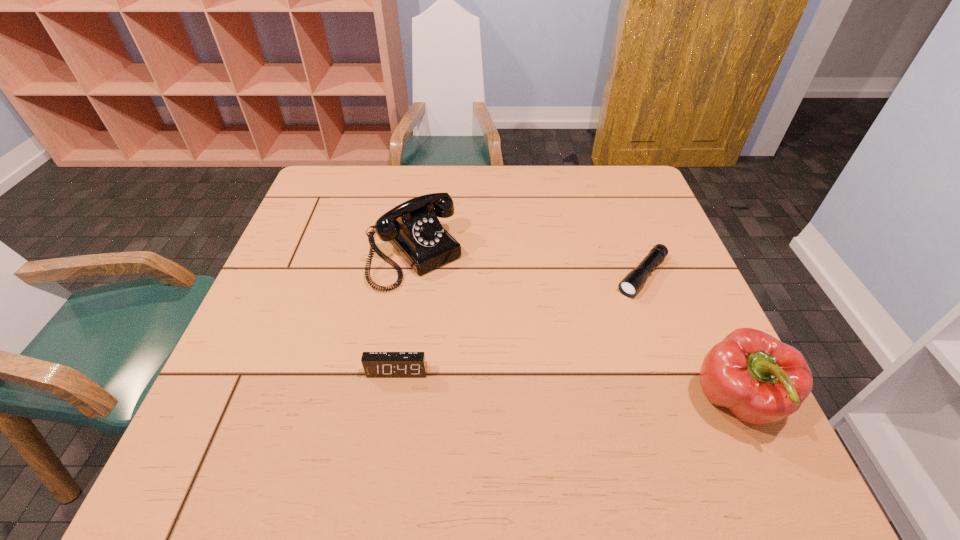
The image size is (960, 540). I want to click on vacant area at the far left corner, so click(x=364, y=169).

In order to click on free point at the near left corner in this screenshot , I will do `click(263, 397)`.

I want to click on vacant space at the far right corner, so click(637, 178).

Locate an element on the screen. The image size is (960, 540). free space at the near right corner of the desktop is located at coordinates (712, 407).

Where is `vacant area that lies between the flashlight and the second shortest object`? vacant area that lies between the flashlight and the second shortest object is located at coordinates (519, 323).

The image size is (960, 540). Find the location of `vacant area between the pepper and the alarm clock`. vacant area between the pepper and the alarm clock is located at coordinates (566, 387).

Locate an element on the screen. Image resolution: width=960 pixels, height=540 pixels. free point between the pepper and the flashlight is located at coordinates (689, 339).

This screenshot has width=960, height=540. Identify the location of free space between the pepper and the telephone. (574, 328).

I want to click on vacant area that lies between the telephone and the flashlight, so click(528, 265).

Where is `empty space between the telephone and the alarm clock`? The width and height of the screenshot is (960, 540). empty space between the telephone and the alarm clock is located at coordinates (405, 313).